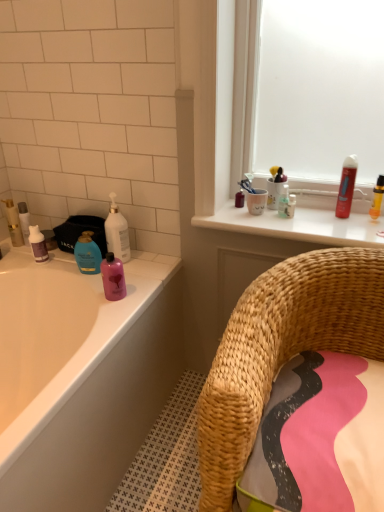
Find the location of `vacant area that lies between red glossy mouthwash at upper right, the 1th mouthwash viewed from the top, and translucent plastic toothbrush at upper center, the third toiletry from the right`. vacant area that lies between red glossy mouthwash at upper right, the 1th mouthwash viewed from the top, and translucent plastic toothbrush at upper center, the third toiletry from the right is located at coordinates (311, 214).